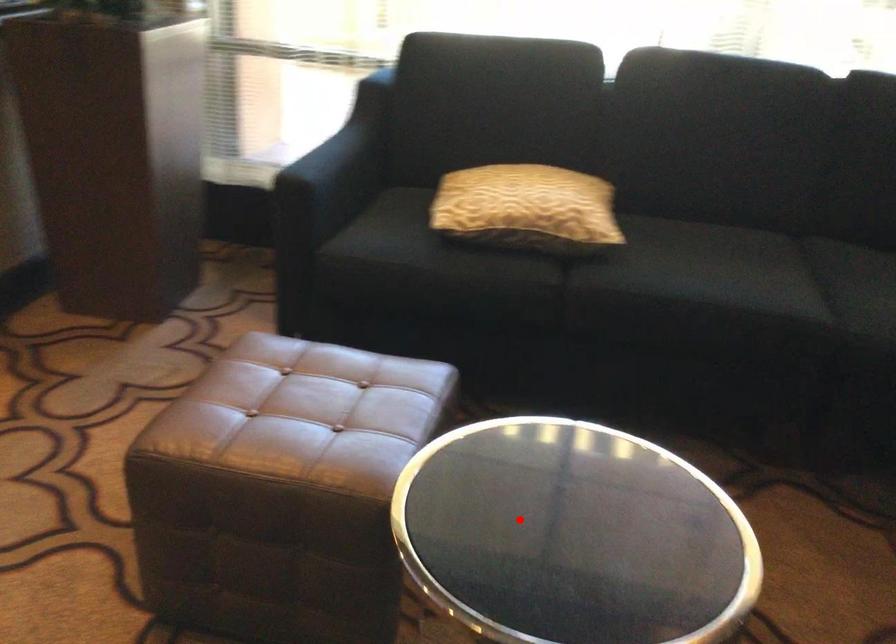
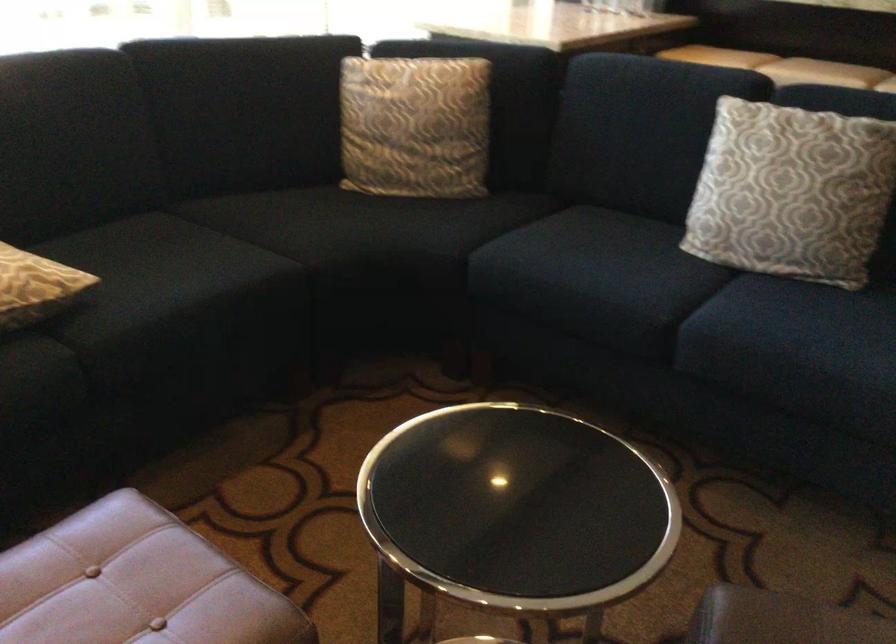
Question: I am providing you with two images of the same scene from different viewpoints. Image1 has a red point marked. In image2, the corresponding 3D location appears at what relative position? Reply with the corresponding letter.

Choices:
 (A) Closer
 (B) Farther

Answer: (B)